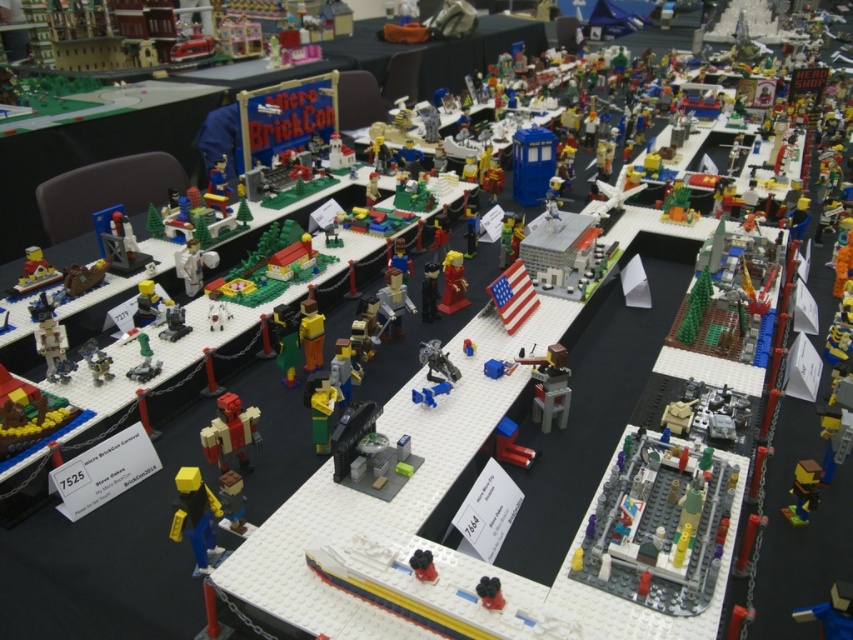
Question: Which of these objects is positioned closest to the blue plastic toy at lower right?

Choices:
 (A) yellow plastic figure at center
 (B) brick-like red robot at center

Answer: (A)

Question: Which point is farther to the camera?

Choices:
 (A) (215, 552)
 (B) (223, 452)
 (C) (838, 625)

Answer: (B)

Question: Which of these objects is positioned farthest from the yellow plastic figure at center?

Choices:
 (A) brick-like red robot at center
 (B) blue plastic toy at lower right

Answer: (B)

Question: Does yellow plastic figure at center appear on the right side of brick-like red robot at center?

Choices:
 (A) yes
 (B) no

Answer: (B)

Question: Can you confirm if yellow plastic figure at center is thinner than blue plastic toy at lower right?

Choices:
 (A) no
 (B) yes

Answer: (A)

Question: Is brick-like red robot at center to the right of blue plastic toy at lower right from the viewer's perspective?

Choices:
 (A) yes
 (B) no

Answer: (B)